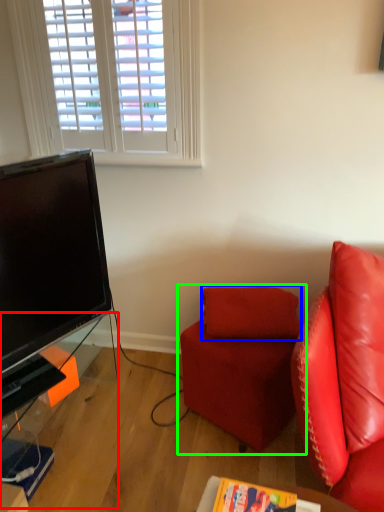
Question: Estimate the real-world distances between objects in this image. Which object is farther from table (highlighted by a red box), pillow (highlighted by a blue box) or studio couch (highlighted by a green box)?

Choices:
 (A) pillow
 (B) studio couch

Answer: (A)